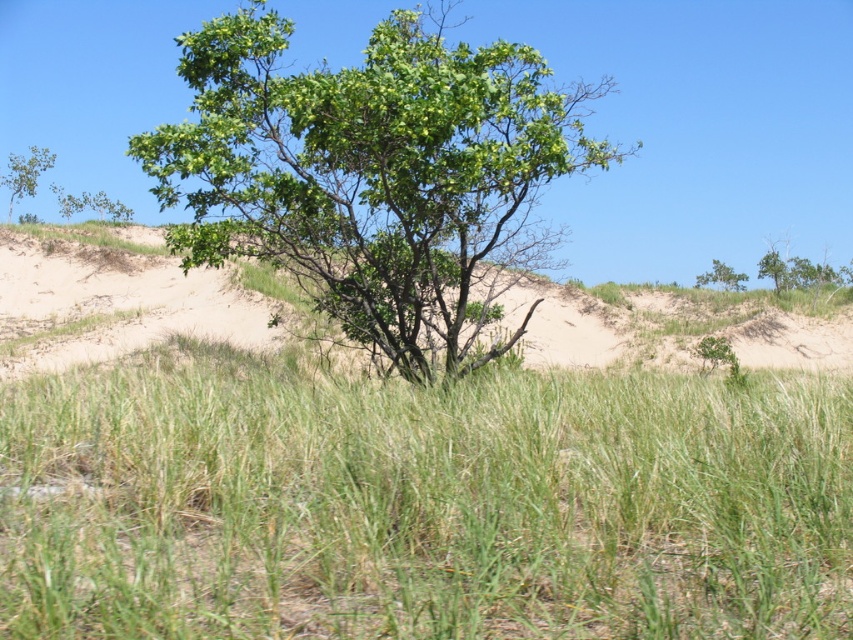
You are a gardener planning to mow the green grassy at center and trim the green leafy tree at upper left. Which area will require more time to maintain based on their sizes?

The green leafy tree at upper left requires more time to maintain because it occupies more space than the green grassy at center.

You are a bird looking for a place to perch. You see the green leafy tree at center and the green leafy tree at upper right. Which tree is closer to the ground?

The green leafy tree at upper right is closer to the ground because the green leafy tree at center is positioned over it.